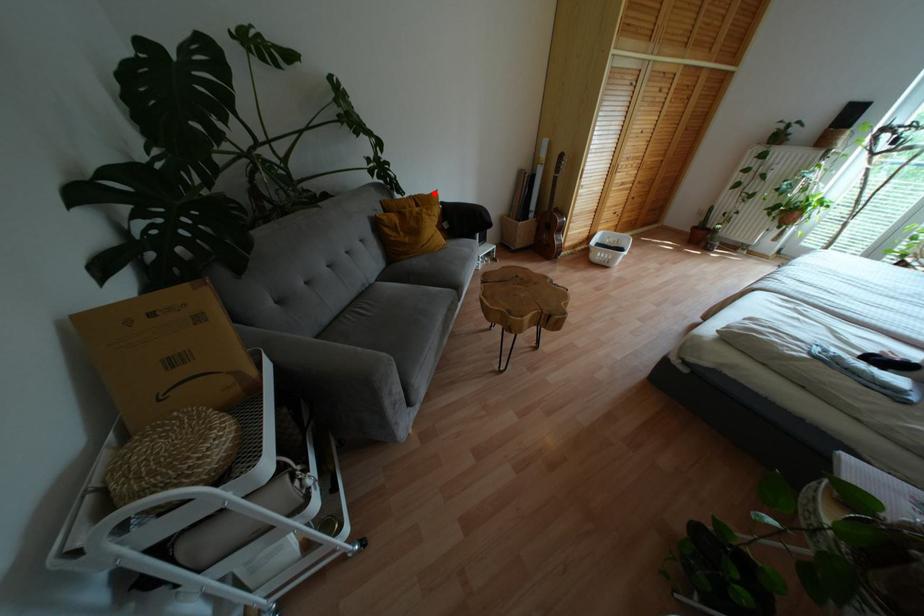
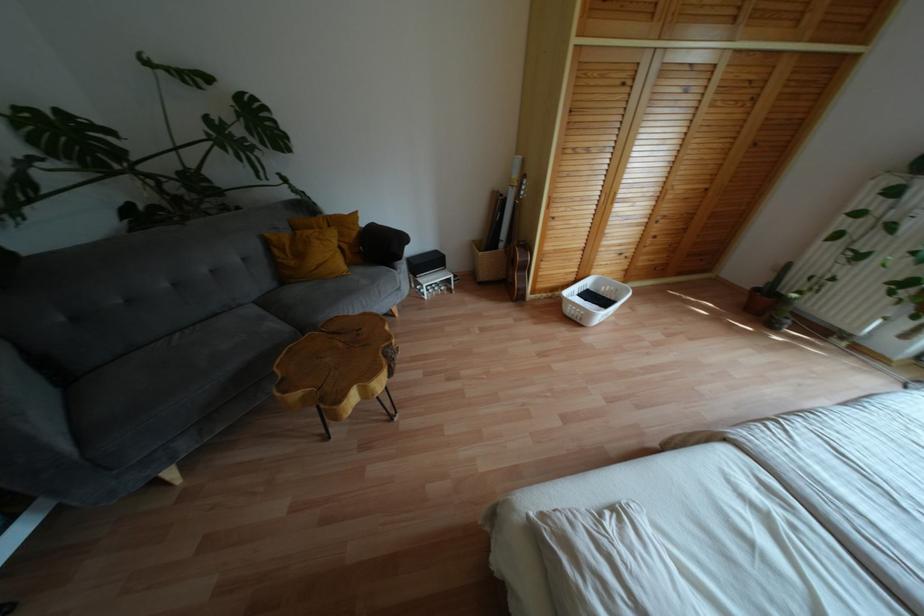
Find the pixel in the second image that matches the highlighted location in the first image.

(354, 214)